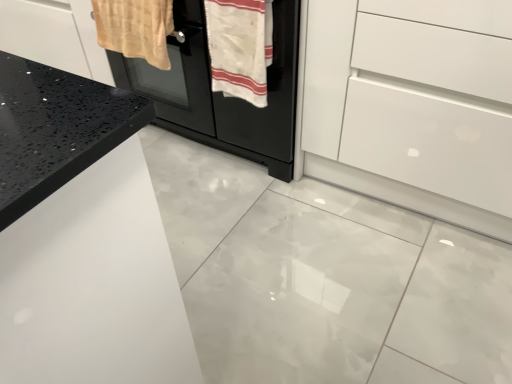
Question: Is white glossy drawer at center positioned beyond the bounds of black matte oven at center?

Choices:
 (A) yes
 (B) no

Answer: (A)

Question: From the image's perspective, is white glossy drawer at center below black matte oven at center?

Choices:
 (A) yes
 (B) no

Answer: (A)

Question: Can you confirm if white glossy drawer at center is positioned to the right of black matte oven at center?

Choices:
 (A) yes
 (B) no

Answer: (A)

Question: Is white glossy drawer at center wider than black matte oven at center?

Choices:
 (A) yes
 (B) no

Answer: (A)

Question: Is white glossy drawer at center further to camera compared to black matte oven at center?

Choices:
 (A) no
 (B) yes

Answer: (A)

Question: From a real-world perspective, is white glossy drawer at center positioned over black matte oven at center based on gravity?

Choices:
 (A) no
 (B) yes

Answer: (B)

Question: Is the position of black matte oven at center more distant than that of beige woven towel at upper left, which is the 1th bath towel from left to right?

Choices:
 (A) no
 (B) yes

Answer: (A)

Question: Could beige woven towel at upper left, which is the 1th bath towel from left to right, be considered to be inside black matte oven at center?

Choices:
 (A) yes
 (B) no

Answer: (B)

Question: Does black matte oven at center appear on the right side of beige woven towel at upper left, which is the 1th bath towel from left to right?

Choices:
 (A) yes
 (B) no

Answer: (A)

Question: Does black matte oven at center have a greater width compared to beige woven towel at upper left, which is the 1th bath towel from left to right?

Choices:
 (A) yes
 (B) no

Answer: (A)

Question: From a real-world perspective, does black matte oven at center sit lower than beige woven towel at upper left, positioned as the second bath towel in right-to-left order?

Choices:
 (A) no
 (B) yes

Answer: (B)

Question: From the image's perspective, is black matte oven at center on beige woven towel at upper left, which is the 1th bath towel from left to right?

Choices:
 (A) no
 (B) yes

Answer: (B)

Question: Could white glossy drawer at center be considered to be inside beige woven towel at upper left, positioned as the second bath towel in right-to-left order?

Choices:
 (A) yes
 (B) no

Answer: (B)